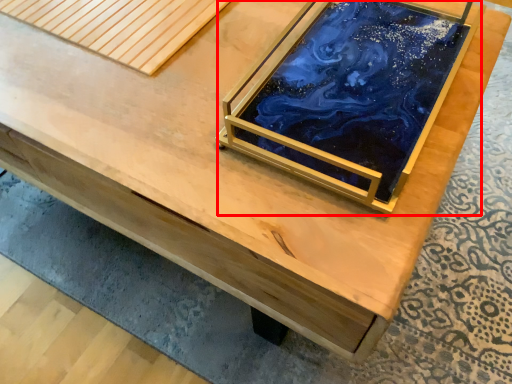
Question: Where is glass box (annotated by the red box) located in relation to plank in the image?

Choices:
 (A) left
 (B) right

Answer: (B)